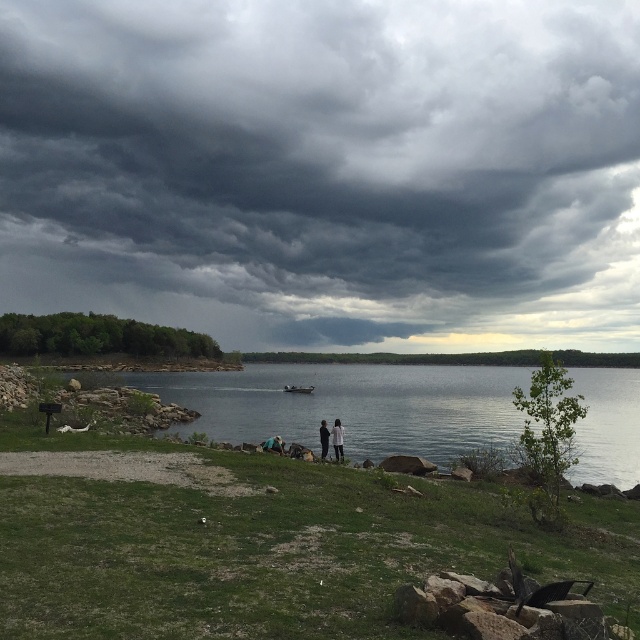
You are packing a bag for a lakeside camping trip and need to decide which item to place first based on their sizes. Given that you have a light brown leather jacket at center and dark blue jeans at center, which item should you place first into the bag?

The light brown leather jacket at center has a larger width than the dark blue jeans at center, so you should place the light brown leather jacket at center first to ensure it fits properly in the bag.

From the picture: You are standing at the camera position and want to throw a pebble to reach the dark gray fabric couple at center. If your throwing range is 30 meters, will the pebble reach them?

The dark gray fabric couple at center is 33.94 meters away from the camera, which is beyond your throwing range of 30 meters. The pebble will not reach them.

You are planning to take a photo of the dark gray fabric couple at center and the metallic gray boat at center from the lakeside. Which object should you focus on first if you want to capture both in the same frame without moving the camera?

The dark gray fabric couple at center is located above the metallic gray boat at center, so you should focus on the metallic gray boat at center first to ensure both are in the frame.